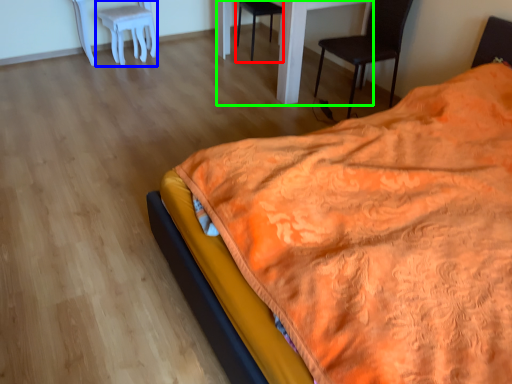
Question: Which is farther away from chair (highlighted by a red box)? stool (highlighted by a blue box) or table (highlighted by a green box)?

Choices:
 (A) stool
 (B) table

Answer: (B)